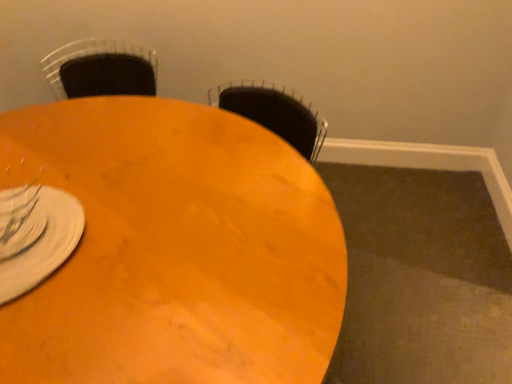
Question: Considering the relative positions of clear glass fork at lower left and wooden table at center in the image provided, is clear glass fork at lower left to the left or to the right of wooden table at center?

Choices:
 (A) right
 (B) left

Answer: (B)

Question: From the image's perspective, relative to wooden table at center, is clear glass fork at lower left above or below?

Choices:
 (A) below
 (B) above

Answer: (B)

Question: Considering the positions of clear glass fork at lower left and wooden table at center in the image, is clear glass fork at lower left wider or thinner than wooden table at center?

Choices:
 (A) thin
 (B) wide

Answer: (A)

Question: Looking at their shapes, would you say wooden table at center is wider or thinner than clear glass fork at lower left?

Choices:
 (A) thin
 (B) wide

Answer: (B)

Question: From a real-world perspective, is wooden table at center above or below clear glass fork at lower left?

Choices:
 (A) above
 (B) below

Answer: (B)

Question: Looking at the image, does wooden table at center seem bigger or smaller compared to clear glass fork at lower left?

Choices:
 (A) big
 (B) small

Answer: (A)

Question: Considering the positions of point (222, 342) and point (10, 253), is point (222, 342) closer or farther from the camera than point (10, 253)?

Choices:
 (A) closer
 (B) farther

Answer: (A)